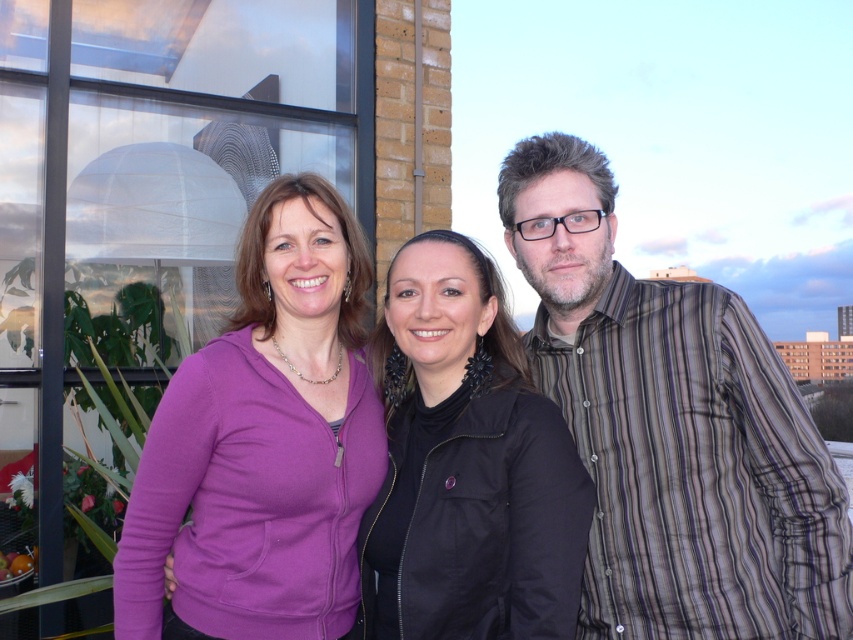
Question: Which object appears closest to the camera in this image?

Choices:
 (A) black fabric jacket at center
 (B) striped cotton shirt at right

Answer: (A)

Question: Can you confirm if striped cotton shirt at right is positioned to the left of purple fleece jacket at center?

Choices:
 (A) yes
 (B) no

Answer: (B)

Question: Which object is positioned closest to the purple fleece jacket at center?

Choices:
 (A) black fabric jacket at center
 (B) striped cotton shirt at right

Answer: (A)

Question: Based on their relative distances, which object is nearer to the purple fleece jacket at center?

Choices:
 (A) black fabric jacket at center
 (B) striped cotton shirt at right

Answer: (A)

Question: Is purple fleece jacket at center to the left of black fabric jacket at center from the viewer's perspective?

Choices:
 (A) yes
 (B) no

Answer: (A)

Question: Can you confirm if purple fleece jacket at center is smaller than black fabric jacket at center?

Choices:
 (A) yes
 (B) no

Answer: (B)